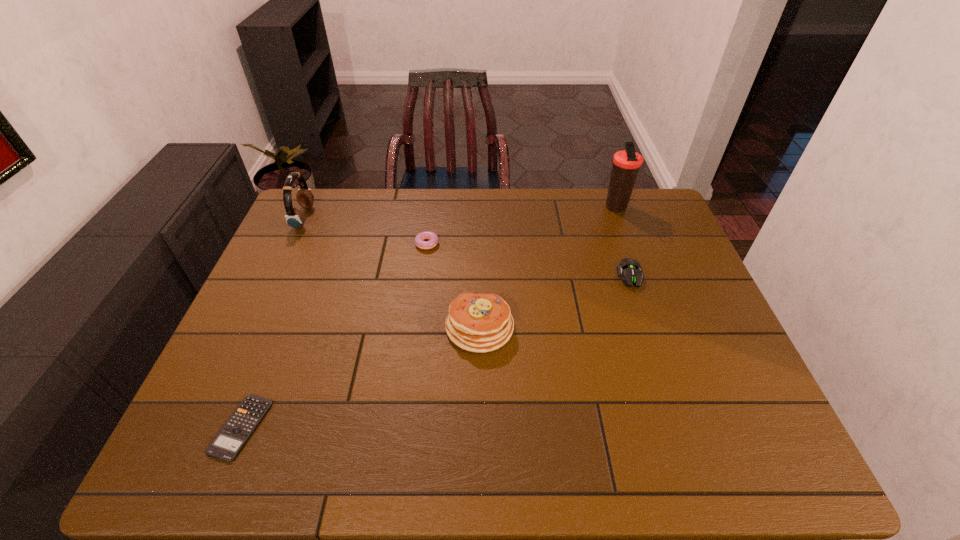
Image resolution: width=960 pixels, height=540 pixels. In order to click on unoccupied position between the thermos bottle and the nearest object in this screenshot , I will do `click(428, 317)`.

Identify the location of free area in between the headset and the pancake. (392, 272).

At what (x,y) coordinates should I click in order to perform the action: click on free spot between the computer mouse and the third tallest object. Please return your answer as a coordinate pair (x, y). The height and width of the screenshot is (540, 960). Looking at the image, I should click on (555, 301).

This screenshot has width=960, height=540. Identify the location of free space between the third object from left to right and the second tallest object. (364, 231).

At what (x,y) coordinates should I click in order to perform the action: click on free space between the doughnut and the fourth shortest object. Please return your answer as a coordinate pair (x, y). Image resolution: width=960 pixels, height=540 pixels. Looking at the image, I should click on (452, 285).

Where is `unoccupied position between the second nearest object and the computer mouse`? The height and width of the screenshot is (540, 960). unoccupied position between the second nearest object and the computer mouse is located at coordinates (555, 301).

Identify the location of vacant area that lies between the calculator and the fifth shortest object. The height and width of the screenshot is (540, 960). (273, 322).

Where is `empty space that is in between the third nearest object and the third farthest object`? This screenshot has height=540, width=960. empty space that is in between the third nearest object and the third farthest object is located at coordinates (527, 260).

At what (x,y) coordinates should I click in order to perform the action: click on unoccupied area between the tallest object and the third tallest object. Please return your answer as a coordinate pair (x, y). Looking at the image, I should click on (547, 267).

What are the coordinates of `object that is the fourth nearest to the computer mouse` in the screenshot? It's located at (227, 444).